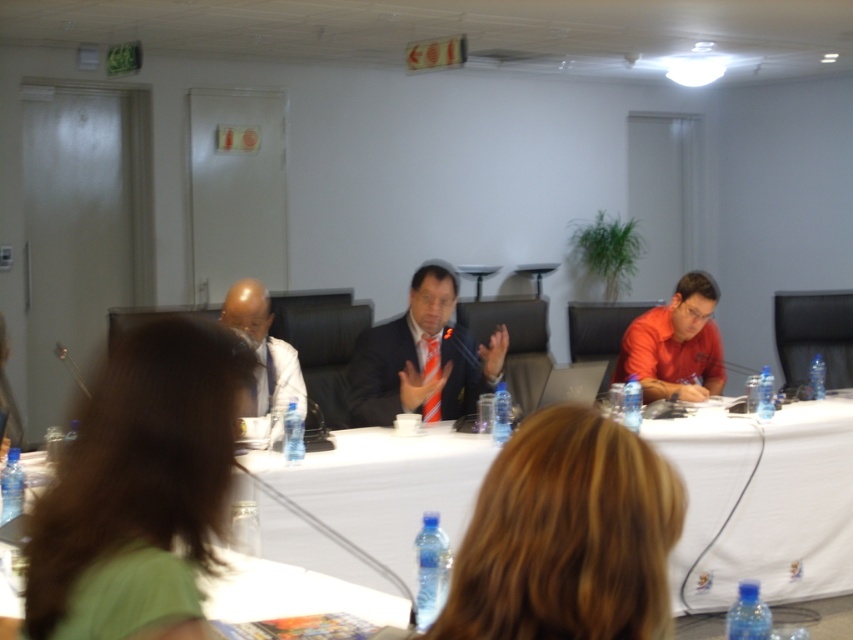
Question: Which of the following is the farthest from the observer?

Choices:
 (A) orange matte shirt at right
 (B) striped tie suit at center
 (C) blonde hair at center

Answer: (A)

Question: Among these objects, which one is farthest from the camera?

Choices:
 (A) striped tie suit at center
 (B) green matte shirt at center

Answer: (A)

Question: Is green matte shirt at center below blonde hair at center?

Choices:
 (A) yes
 (B) no

Answer: (B)

Question: Can you confirm if orange matte shirt at right is bigger than matte white shirt at left?

Choices:
 (A) no
 (B) yes

Answer: (B)

Question: Is white fabric table at center wider than matte white shirt at left?

Choices:
 (A) no
 (B) yes

Answer: (B)

Question: Among these objects, which one is nearest to the camera?

Choices:
 (A) blonde hair at center
 (B) orange matte shirt at right

Answer: (A)